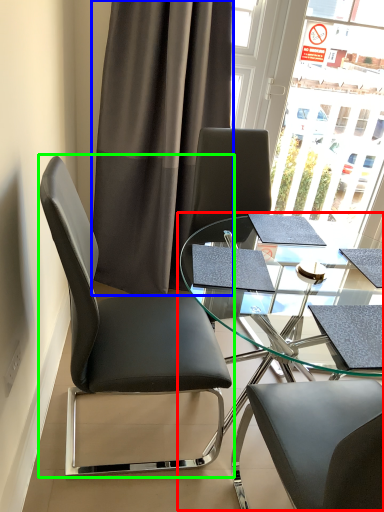
Question: Which object is the closest to the table (highlighted by a red box)? Choose among these: curtain (highlighted by a blue box) or chair (highlighted by a green box).

Choices:
 (A) curtain
 (B) chair

Answer: (B)